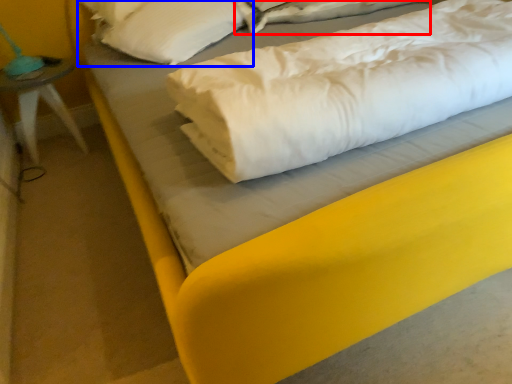
Question: Which object is further to the camera taking this photo, sheet (highlighted by a red box) or pillow (highlighted by a blue box)?

Choices:
 (A) sheet
 (B) pillow

Answer: (A)